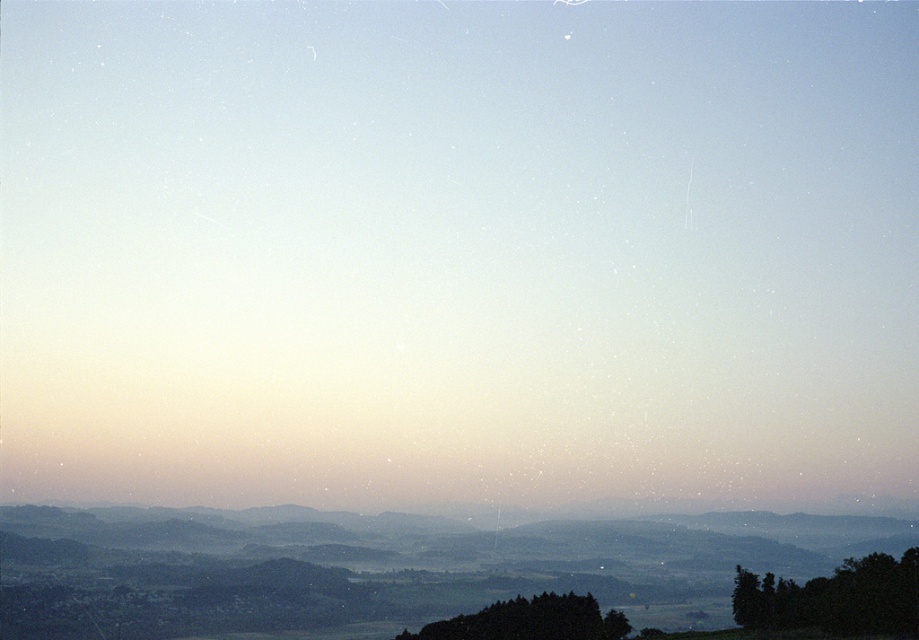
You are standing in the landscape scene and want to walk towards the two points marked in the image. Which point, point (870, 580) or point (570, 616), will you reach first?

You will reach point (870, 580) first because it is closer to the viewer than point (570, 616).

You are standing at the center of the image and want to walk towards the green leafy tree at lower right. In which direction should you move?

Since the green leafy tree at lower right is located at point 0.936 on the x axis and 0.910 on the y axis, you should move towards the lower right direction to reach it.